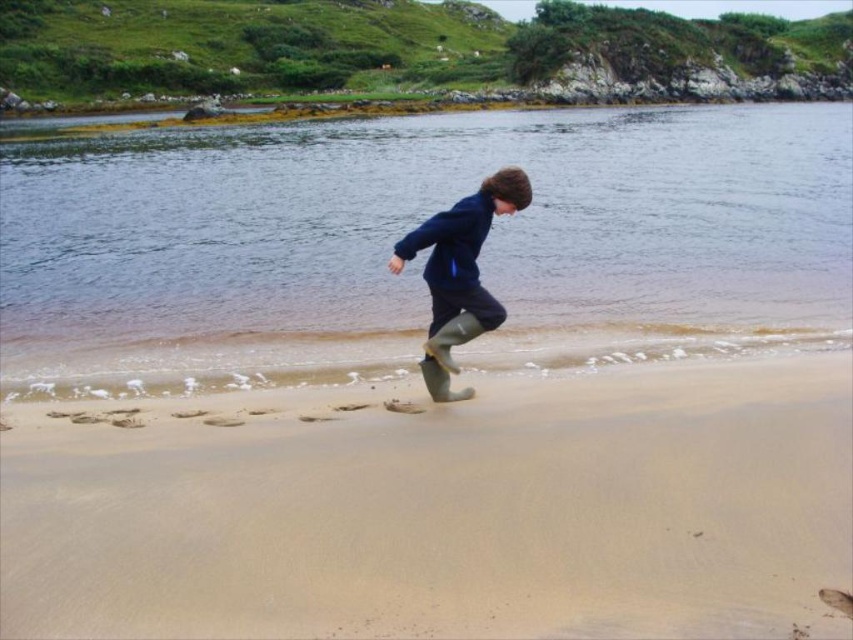
You are a drone operator trying to capture the child running on the beach. The drone is currently hovering at point 0.8, 0.5. Is the smooth sand at lower center directly below the drone?

The smooth sand at lower center is located at point (444,509), which is very close to the drone at (426,512). Since the coordinates are nearly the same, the smooth sand at lower center is directly below the drone.